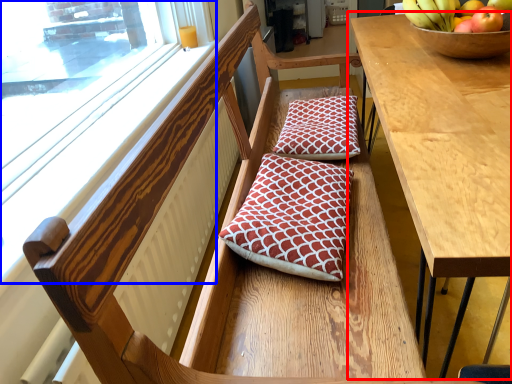
Question: Which of the following is the farthest to the observer, table (highlighted by a red box) or window (highlighted by a blue box)?

Choices:
 (A) table
 (B) window

Answer: (B)